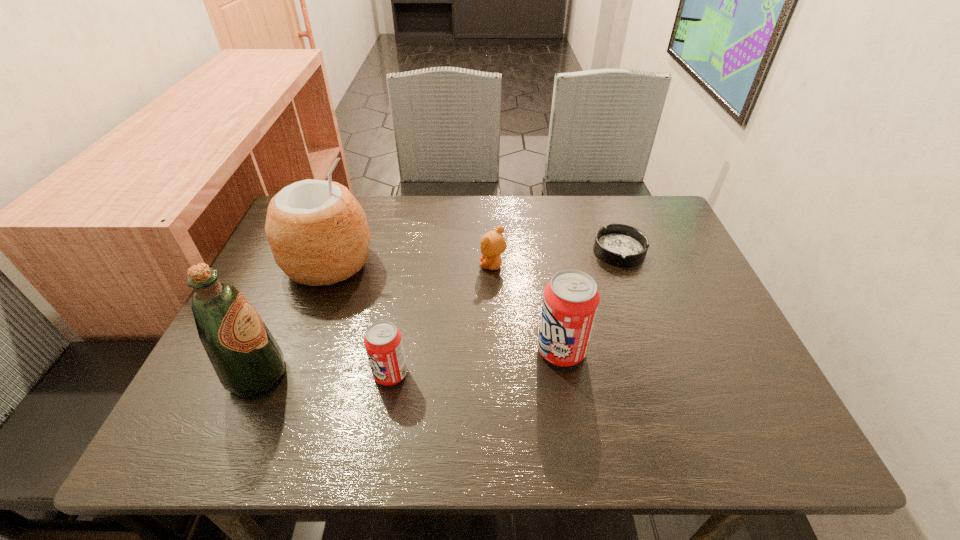
This screenshot has width=960, height=540. I want to click on vacant position at the far edge of the desktop, so click(x=421, y=200).

Image resolution: width=960 pixels, height=540 pixels. What are the coordinates of `vacant space at the near edge of the desktop` in the screenshot? It's located at (550, 395).

Where is `vacant space at the right edge of the desktop`? vacant space at the right edge of the desktop is located at coordinates (652, 250).

The height and width of the screenshot is (540, 960). What are the coordinates of `unoccupied position between the ashtray and the left soda can` in the screenshot? It's located at (505, 312).

Find the location of `vacant area between the rightmost object and the third object from right to left`. vacant area between the rightmost object and the third object from right to left is located at coordinates (556, 258).

Where is `vacant area between the shortest object and the coconut`? This screenshot has height=540, width=960. vacant area between the shortest object and the coconut is located at coordinates (474, 257).

I want to click on empty location between the coconut and the olive oil, so click(x=293, y=320).

Locate an element on the screen. free space between the fifth object from left to right and the left soda can is located at coordinates (476, 362).

This screenshot has width=960, height=540. I want to click on free space between the olive oil and the taller soda can, so click(409, 362).

Identify the location of vacant area that lies between the third object from right to left and the fourth shortest object. The width and height of the screenshot is (960, 540). (527, 308).